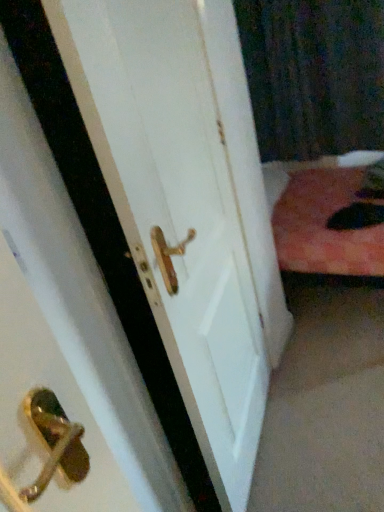
Question: Is black textured curtain at upper right aimed at fluffy black cat at lower right?

Choices:
 (A) yes
 (B) no

Answer: (A)

Question: Does black textured curtain at upper right appear on the left side of fluffy black cat at lower right?

Choices:
 (A) no
 (B) yes

Answer: (B)

Question: Considering the relative positions of black textured curtain at upper right and fluffy black cat at lower right in the image provided, is black textured curtain at upper right to the right of fluffy black cat at lower right from the viewer's perspective?

Choices:
 (A) yes
 (B) no

Answer: (B)

Question: Considering the relative sizes of black textured curtain at upper right and fluffy black cat at lower right in the image provided, is black textured curtain at upper right smaller than fluffy black cat at lower right?

Choices:
 (A) no
 (B) yes

Answer: (A)

Question: From a real-world perspective, is black textured curtain at upper right on top of fluffy black cat at lower right?

Choices:
 (A) yes
 (B) no

Answer: (A)

Question: From a real-world perspective, relative to fluffy black cat at lower right, is white matte door handle at center vertically above or below?

Choices:
 (A) above
 (B) below

Answer: (A)

Question: Looking at their shapes, would you say white matte door handle at center is wider or thinner than fluffy black cat at lower right?

Choices:
 (A) wide
 (B) thin

Answer: (B)

Question: Which is correct: white matte door handle at center is inside fluffy black cat at lower right, or outside of it?

Choices:
 (A) inside
 (B) outside

Answer: (B)

Question: From the image's perspective, relative to fluffy black cat at lower right, is white matte door handle at center above or below?

Choices:
 (A) below
 (B) above

Answer: (A)

Question: From their relative heights in the image, would you say white matte door handle at center is taller or shorter than black textured curtain at upper right?

Choices:
 (A) short
 (B) tall

Answer: (B)

Question: Considering the positions of point (266, 215) and point (271, 146), is point (266, 215) closer or farther from the camera than point (271, 146)?

Choices:
 (A) farther
 (B) closer

Answer: (B)

Question: Do you think white matte door handle at center is within black textured curtain at upper right, or outside of it?

Choices:
 (A) inside
 (B) outside

Answer: (B)

Question: From the image's perspective, is white matte door handle at center above or below black textured curtain at upper right?

Choices:
 (A) below
 (B) above

Answer: (A)

Question: Considering their positions, is fluffy black cat at lower right located in front of or behind white matte door handle at center?

Choices:
 (A) front
 (B) behind

Answer: (B)

Question: Is point (345, 216) positioned closer to the camera than point (178, 52)?

Choices:
 (A) closer
 (B) farther

Answer: (B)